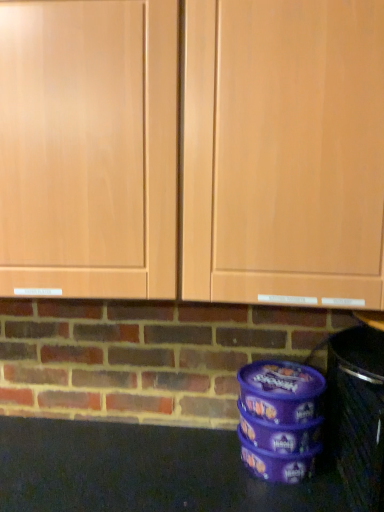
The height and width of the screenshot is (512, 384). In order to click on matte wood cabinets at center in this screenshot , I will do `click(193, 151)`.

This screenshot has height=512, width=384. What do you see at coordinates (193, 151) in the screenshot? I see `matte wood cabinets at center` at bounding box center [193, 151].

In order to face matte wood cabinets at center, should I rotate leftwards or rightwards?

To face it directly, rotate left by 2.208 degrees.

The image size is (384, 512). I want to click on matte wood cabinets at center, so point(193,151).